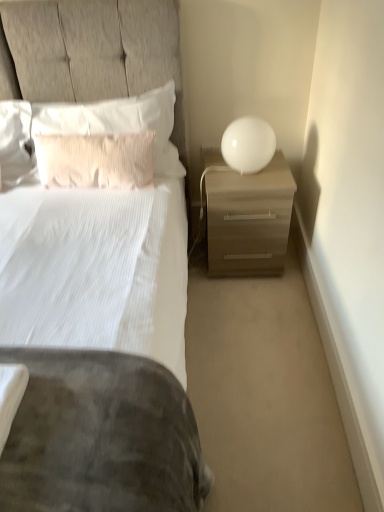
What are the coordinates of `pink textured pillow at upper left, which ranks as the first pillow in bottom-to-top order` in the screenshot? It's located at (95, 160).

This screenshot has height=512, width=384. What do you see at coordinates (248, 144) in the screenshot?
I see `white glossy sphere at upper right` at bounding box center [248, 144].

Find the location of `matte wood nightstand at right`. matte wood nightstand at right is located at coordinates (249, 219).

Is white textured pillow at upper left, positioned as the first pillow in top-to-bottom order, far away from matte wood nightstand at right?

Actually, white textured pillow at upper left, positioned as the first pillow in top-to-bottom order, and matte wood nightstand at right are a little close together.

How different are the orientations of white textured pillow at upper left, positioned as the first pillow in top-to-bottom order, and matte wood nightstand at right in degrees?

There is a 0.187-degree angle between the facing directions of white textured pillow at upper left, positioned as the first pillow in top-to-bottom order, and matte wood nightstand at right.

Could you tell me if white textured pillow at upper left, positioned as the second pillow in bottom-to-top order, is turned towards matte wood nightstand at right?

No, white textured pillow at upper left, positioned as the second pillow in bottom-to-top order, is not aimed at matte wood nightstand at right.

The width and height of the screenshot is (384, 512). Find the location of `the 1st pillow in front of the matte wood nightstand at right`. the 1st pillow in front of the matte wood nightstand at right is located at coordinates (118, 123).

Considering the points (69, 124) and (94, 166), which point is in front, point (69, 124) or point (94, 166)?

The point (94, 166) is in front.

Measure the distance from white textured pillow at upper left, positioned as the first pillow in top-to-bottom order, to pink textured pillow at upper left, which is the second pillow in top-to-bottom order.

They are 5.55 inches apart.

In terms of height, does white textured pillow at upper left, positioned as the second pillow in bottom-to-top order, look taller or shorter compared to pink textured pillow at upper left, which is the second pillow in top-to-bottom order?

Clearly, white textured pillow at upper left, positioned as the second pillow in bottom-to-top order, is taller compared to pink textured pillow at upper left, which is the second pillow in top-to-bottom order.

Which of these two, white textured pillow at upper left, positioned as the second pillow in bottom-to-top order, or white glossy sphere at upper right, stands taller?

white textured pillow at upper left, positioned as the second pillow in bottom-to-top order.

Is white textured pillow at upper left, positioned as the second pillow in bottom-to-top order, looking in the opposite direction of white glossy sphere at upper right?

No, white textured pillow at upper left, positioned as the second pillow in bottom-to-top order,'s orientation is not away from white glossy sphere at upper right.

In the scene shown: Between white textured pillow at upper left, positioned as the first pillow in top-to-bottom order, and white glossy sphere at upper right, which one is positioned in front?

white glossy sphere at upper right is in front.

From the picture: From the image's perspective, is white textured pillow at upper left, positioned as the second pillow in bottom-to-top order, located above or below white glossy sphere at upper right?

Based on their image positions, white textured pillow at upper left, positioned as the second pillow in bottom-to-top order, is located above white glossy sphere at upper right.

From the image's perspective, is matte wood nightstand at right beneath white glossy sphere at upper right?

Indeed, from the image's perspective, matte wood nightstand at right is shown beneath white glossy sphere at upper right.

Is matte wood nightstand at right to the left of white glossy sphere at upper right from the viewer's perspective?

Incorrect, matte wood nightstand at right is not on the left side of white glossy sphere at upper right.

Considering the sizes of objects matte wood nightstand at right and white glossy sphere at upper right in the image provided, who is bigger, matte wood nightstand at right or white glossy sphere at upper right?

Bigger between the two is matte wood nightstand at right.

Who is taller, matte wood nightstand at right or white glossy sphere at upper right?

matte wood nightstand at right.

Looking at their sizes, would you say white glossy sphere at upper right is wider or thinner than matte wood nightstand at right?

In the image, white glossy sphere at upper right appears to be more narrow than matte wood nightstand at right.

Is white glossy sphere at upper right bigger or smaller than matte wood nightstand at right?

Considering their sizes, white glossy sphere at upper right takes up less space than matte wood nightstand at right.

How many degrees apart are the facing directions of white glossy sphere at upper right and matte wood nightstand at right?

0.000138 degrees.

Is white glossy sphere at upper right outside of matte wood nightstand at right?

Absolutely, white glossy sphere at upper right is external to matte wood nightstand at right.

Can you confirm if matte wood nightstand at right is thinner than pink textured pillow at upper left, which is the second pillow in top-to-bottom order?

Incorrect, the width of matte wood nightstand at right is not less than that of pink textured pillow at upper left, which is the second pillow in top-to-bottom order.

Is matte wood nightstand at right facing away from pink textured pillow at upper left, which is the second pillow in top-to-bottom order?

No, matte wood nightstand at right is not facing away from pink textured pillow at upper left, which is the second pillow in top-to-bottom order.

Which object is closer to the camera taking this photo, matte wood nightstand at right or pink textured pillow at upper left, which ranks as the first pillow in bottom-to-top order?

pink textured pillow at upper left, which ranks as the first pillow in bottom-to-top order, is in front.

Based on the photo, is pink textured pillow at upper left, which ranks as the first pillow in bottom-to-top order, completely or partially inside matte wood nightstand at right?

No, pink textured pillow at upper left, which ranks as the first pillow in bottom-to-top order, is not a part of matte wood nightstand at right.

Can you see pink textured pillow at upper left, which is the second pillow in top-to-bottom order, touching matte wood nightstand at right?

No, pink textured pillow at upper left, which is the second pillow in top-to-bottom order, is not beside matte wood nightstand at right.

Is pink textured pillow at upper left, which is the second pillow in top-to-bottom order, inside or outside of matte wood nightstand at right?

pink textured pillow at upper left, which is the second pillow in top-to-bottom order, exists outside the volume of matte wood nightstand at right.

Find the location of `nightstand that appears behind the pink textured pillow at upper left, which ranks as the first pillow in bottom-to-top order`. nightstand that appears behind the pink textured pillow at upper left, which ranks as the first pillow in bottom-to-top order is located at coordinates (249, 219).

From a real-world perspective, which is physically below, pink textured pillow at upper left, which ranks as the first pillow in bottom-to-top order, or matte wood nightstand at right?

In real-world perspective, matte wood nightstand at right is lower.

From the image's perspective, starting from the matte wood nightstand at right, which pillow is the 2nd one above? Please provide its 2D coordinates.

[(118, 123)]

Locate an element on the screen. pillow below the white textured pillow at upper left, positioned as the second pillow in bottom-to-top order (from a real-world perspective) is located at coordinates (95, 160).

Based on the photo, when comparing their distances from matte wood nightstand at right, does white glossy sphere at upper right or white textured pillow at upper left, positioned as the first pillow in top-to-bottom order, seem further?

white textured pillow at upper left, positioned as the first pillow in top-to-bottom order, is positioned further to the anchor matte wood nightstand at right.

From the image, which object appears to be farther from white glossy sphere at upper right, matte wood nightstand at right or pink textured pillow at upper left, which is the second pillow in top-to-bottom order?

pink textured pillow at upper left, which is the second pillow in top-to-bottom order.

Which object lies nearer to the anchor point white textured pillow at upper left, positioned as the first pillow in top-to-bottom order, pink textured pillow at upper left, which ranks as the first pillow in bottom-to-top order, or white glossy sphere at upper right?

pink textured pillow at upper left, which ranks as the first pillow in bottom-to-top order, is positioned closer to the anchor white textured pillow at upper left, positioned as the first pillow in top-to-bottom order.

Looking at the image, which one is located closer to white textured pillow at upper left, positioned as the second pillow in bottom-to-top order, pink textured pillow at upper left, which is the second pillow in top-to-bottom order, or matte wood nightstand at right?

pink textured pillow at upper left, which is the second pillow in top-to-bottom order, is positioned closer to the anchor white textured pillow at upper left, positioned as the second pillow in bottom-to-top order.

From the image, which object appears to be farther from pink textured pillow at upper left, which is the second pillow in top-to-bottom order, white textured pillow at upper left, positioned as the second pillow in bottom-to-top order, or matte wood nightstand at right?

matte wood nightstand at right is positioned further to the anchor pink textured pillow at upper left, which is the second pillow in top-to-bottom order.

Looking at the image, which one is located closer to white glossy sphere at upper right, pink textured pillow at upper left, which ranks as the first pillow in bottom-to-top order, or matte wood nightstand at right?

matte wood nightstand at right lies closer to white glossy sphere at upper right than the other object.

When comparing their distances from matte wood nightstand at right, does white glossy sphere at upper right or pink textured pillow at upper left, which ranks as the first pillow in bottom-to-top order, seem further?

Based on the image, pink textured pillow at upper left, which ranks as the first pillow in bottom-to-top order, appears to be further to matte wood nightstand at right.

Based on their spatial positions, is pink textured pillow at upper left, which ranks as the first pillow in bottom-to-top order, or white textured pillow at upper left, positioned as the first pillow in top-to-bottom order, closer to matte wood nightstand at right?

white textured pillow at upper left, positioned as the first pillow in top-to-bottom order, is positioned closer to the anchor matte wood nightstand at right.

The image size is (384, 512). I want to click on pillow situated between pink textured pillow at upper left, which ranks as the first pillow in bottom-to-top order, and white glossy sphere at upper right from left to right, so click(118, 123).

You are a GUI agent. You are given a task and a screenshot of the screen. Output one action in this format:
    pyautogui.click(x=<x>, y=<y>)
    Task: Click on the pillow between pink textured pillow at upper left, which is the second pillow in top-to-bottom order, and matte wood nightstand at right, in the horizontal direction
    
    Given the screenshot: What is the action you would take?
    pyautogui.click(x=118, y=123)

Locate an element on the screen. The height and width of the screenshot is (512, 384). table lamp located between pink textured pillow at upper left, which ranks as the first pillow in bottom-to-top order, and matte wood nightstand at right in the left-right direction is located at coordinates (248, 144).

At what (x,y) coordinates should I click in order to perform the action: click on table lamp situated between white textured pillow at upper left, positioned as the first pillow in top-to-bottom order, and matte wood nightstand at right from left to right. Please return your answer as a coordinate pair (x, y). This screenshot has width=384, height=512. Looking at the image, I should click on (248, 144).